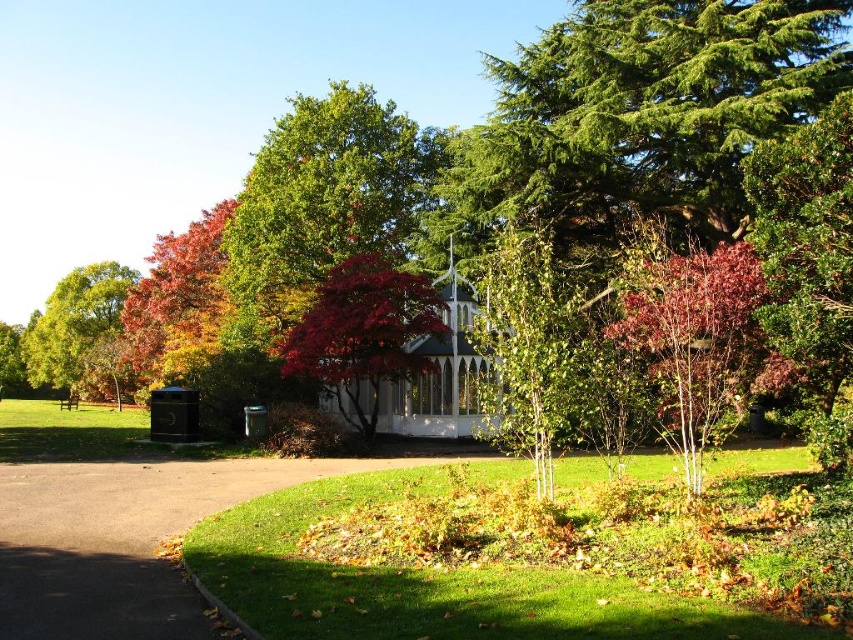
You are standing on the paved pathway in the park and see the green smooth tree at center and the shiny red leaves at left. Which object is nearer to you?

The green smooth tree at center is closer to the viewer than the shiny red leaves at left.

You are a gardener trying to determine which tree to prune first. The shiny red leaves at left and the green leafy tree at left are both in your view. Which tree has wider leaves?

The shiny red leaves at left might be wider than green leafy tree at left, so the gardener should consider pruning the shiny red leaves at left first if wider leaves are a concern.

You are standing at the entrance of the park and want to reach the gazebo. There is a point at coordinates point [834,339] that is 7.40 meters away from you. Can you estimate how far you are from the gazebo?

The point at point [834,339] is 7.40 meters away from you, so you are 7.40 meters away from the gazebo.